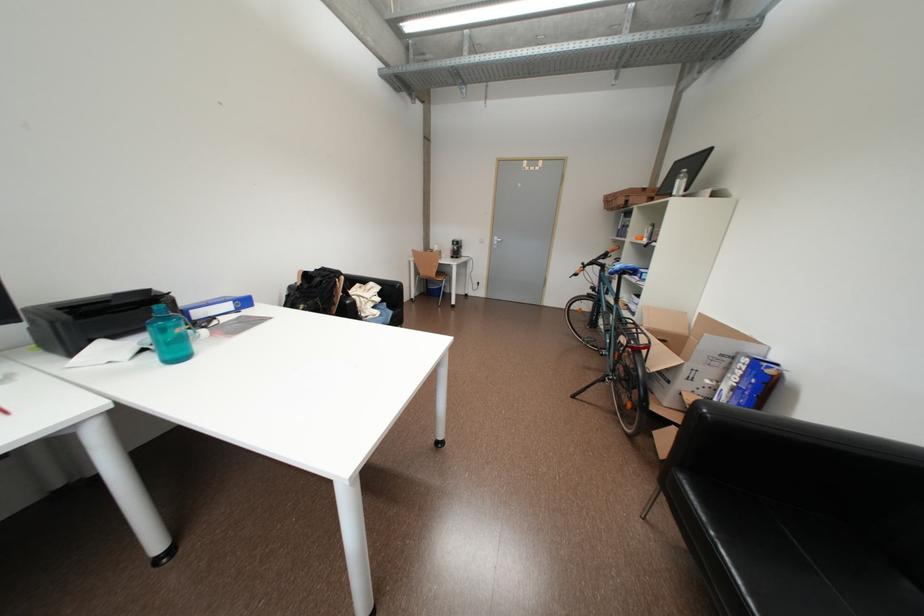
Which object does [168,334] point to?

It corresponds to the green water bottle in the image.